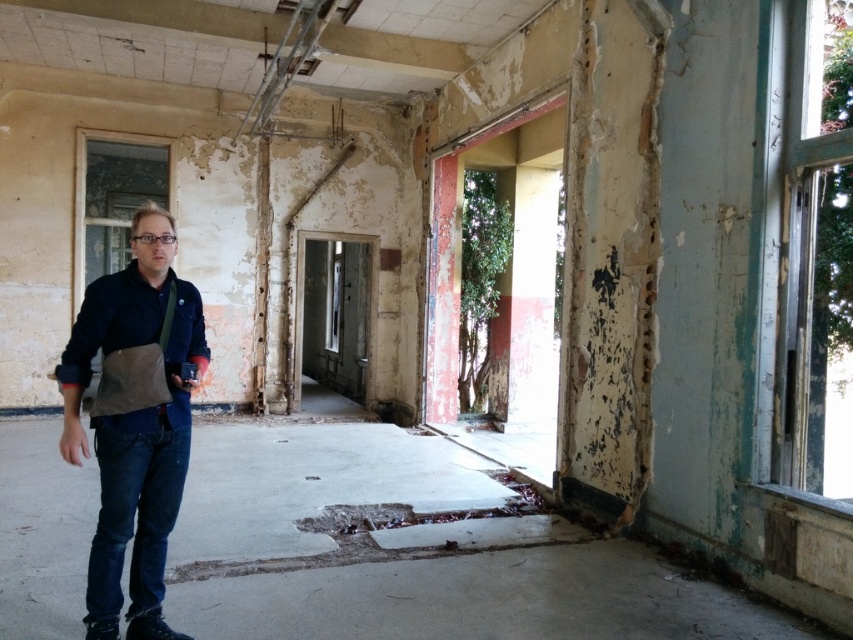
You are a construction worker who needs to place both the dark blue denim jacket at center and the denim jacket at left on a shelf that can only hold items up to 1 meter in width. Based on their sizes, can both jackets fit on the shelf together?

The dark blue denim jacket at center is wider than the denim jacket at left. Since the shelf can hold up to 1 meter, we need to know the exact widths of both jackets to determine if their combined width is within the limit. However, the description only states that the dark blue denim jacket at center is wider, but doesn

You are standing at the entrance of the abandoned building and see two points marked on the floor. The first point is at coordinate point(125, 520) and the second is at point(144, 321). Which point is closer to you?

Point(144, 321) is closer to you because it is less further to the camera than point(125, 520).

You are standing in the abandoned building and see two denim jackets. One is the dark blue denim jacket at center and the other is the denim jacket at left. Which denim jacket is closer to the open doorway at the far end?

The dark blue denim jacket at center is positioned under the denim jacket at left, so the denim jacket at left is closer to the open doorway at the far end.